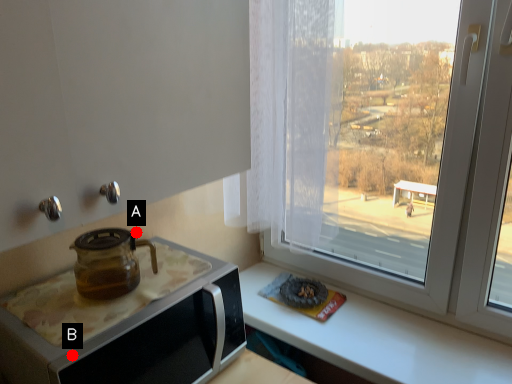
Question: Two points are circled on the image, labeled by A and B beside each circle. Which point is closer to the camera?

Choices:
 (A) A is closer
 (B) B is closer

Answer: (B)